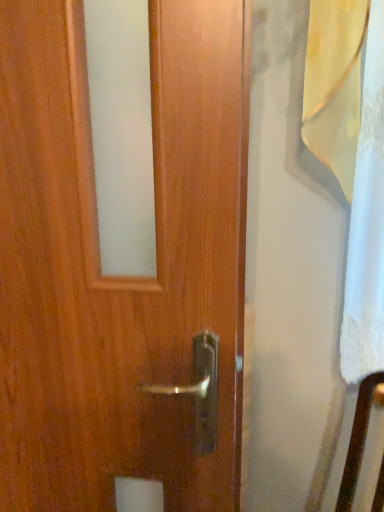
Question: Should I look upward or downward to see wooden door at center?

Choices:
 (A) up
 (B) down

Answer: (B)